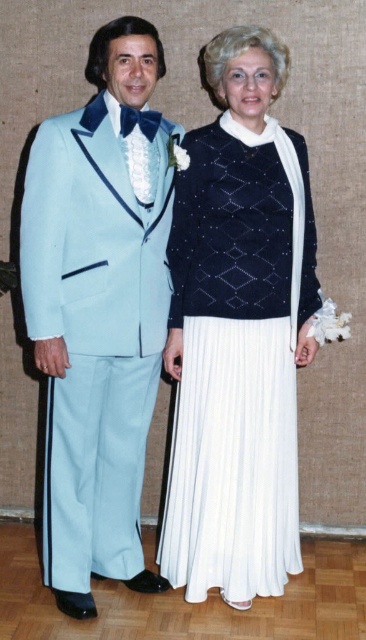
From the picture: Does light blue satin tuxedo at left appear under white pleated skirt at center?

Actually, light blue satin tuxedo at left is above white pleated skirt at center.

Is light blue satin tuxedo at left above white pleated skirt at center?

Yes.

At what (x,y) coordinates should I click in order to perform the action: click on light blue satin tuxedo at left. Please return your answer as a coordinate pair (x, y). The width and height of the screenshot is (366, 640). Looking at the image, I should click on (98, 308).

This screenshot has width=366, height=640. Identify the location of light blue satin tuxedo at left. (98, 308).